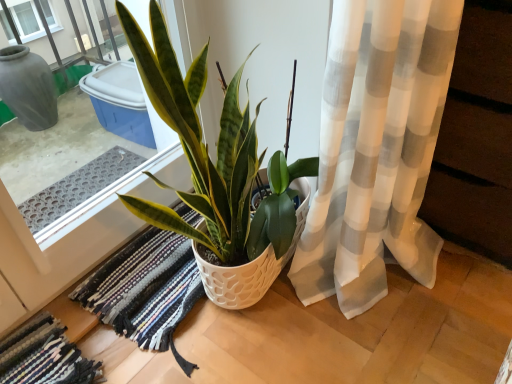
What do you see at coordinates (219, 176) in the screenshot? The height and width of the screenshot is (384, 512). I see `green glossy plant at center` at bounding box center [219, 176].

What do you see at coordinates (146, 290) in the screenshot? The image size is (512, 384). I see `multicolored woven rug at center, the 1th bath mat from the right` at bounding box center [146, 290].

Locate an element on the screen. multicolored woven rug at lower left, which ranks as the 1th bath mat in left-to-right order is located at coordinates (44, 356).

Is multicolored woven rug at lower left, which ranks as the 1th bath mat in left-to-right order, further to the viewer compared to multicolored woven rug at center, the 1th bath mat from the right?

No, multicolored woven rug at lower left, which ranks as the 1th bath mat in left-to-right order, is closer to the viewer.

Is multicolored woven rug at lower left, which is the second bath mat in right-to-left order, bigger or smaller than multicolored woven rug at center, the second bath mat from the left?

multicolored woven rug at lower left, which is the second bath mat in right-to-left order, is smaller than multicolored woven rug at center, the second bath mat from the left.

Can you confirm if multicolored woven rug at lower left, which ranks as the 1th bath mat in left-to-right order, is shorter than multicolored woven rug at center, the second bath mat from the left?

Incorrect, the height of multicolored woven rug at lower left, which ranks as the 1th bath mat in left-to-right order, does not fall short of that of multicolored woven rug at center, the second bath mat from the left.

Find the location of `bath mat in front of the multicolored woven rug at center, the second bath mat from the left`. bath mat in front of the multicolored woven rug at center, the second bath mat from the left is located at coordinates (44, 356).

Considering the relative sizes of multicolored woven rug at center, the second bath mat from the left, and multicolored woven rug at lower left, which ranks as the 1th bath mat in left-to-right order, in the image provided, is multicolored woven rug at center, the second bath mat from the left, wider than multicolored woven rug at lower left, which ranks as the 1th bath mat in left-to-right order,?

Yes, multicolored woven rug at center, the second bath mat from the left, is wider than multicolored woven rug at lower left, which ranks as the 1th bath mat in left-to-right order.

Which of these two, multicolored woven rug at center, the second bath mat from the left, or multicolored woven rug at lower left, which is the second bath mat in right-to-left order, is smaller?

Smaller between the two is multicolored woven rug at lower left, which is the second bath mat in right-to-left order.

Is multicolored woven rug at center, the second bath mat from the left, next to multicolored woven rug at lower left, which is the second bath mat in right-to-left order?

No.

This screenshot has height=384, width=512. Identify the location of bath mat on the right side of multicolored woven rug at lower left, which is the second bath mat in right-to-left order. (146, 290).

How different are the orientations of multicolored woven rug at lower left, which ranks as the 1th bath mat in left-to-right order, and green glossy plant at center in degrees?

multicolored woven rug at lower left, which ranks as the 1th bath mat in left-to-right order, and green glossy plant at center are facing 2.67 degrees away from each other.

From a real-world perspective, which is physically below, multicolored woven rug at lower left, which ranks as the 1th bath mat in left-to-right order, or green glossy plant at center?

From a 3D spatial view, multicolored woven rug at lower left, which ranks as the 1th bath mat in left-to-right order, is below.

Considering the sizes of multicolored woven rug at lower left, which is the second bath mat in right-to-left order, and green glossy plant at center in the image, is multicolored woven rug at lower left, which is the second bath mat in right-to-left order, taller or shorter than green glossy plant at center?

multicolored woven rug at lower left, which is the second bath mat in right-to-left order, is shorter than green glossy plant at center.

Could you tell me if multicolored woven rug at lower left, which ranks as the 1th bath mat in left-to-right order, is facing green glossy plant at center?

No, multicolored woven rug at lower left, which ranks as the 1th bath mat in left-to-right order, is not facing towards green glossy plant at center.

From the image's perspective, relative to multicolored woven rug at lower left, which is the second bath mat in right-to-left order, is green glossy plant at center above or below?

From the image's perspective, green glossy plant at center appears above multicolored woven rug at lower left, which is the second bath mat in right-to-left order.

Relative to multicolored woven rug at lower left, which is the second bath mat in right-to-left order, is green glossy plant at center in front or behind?

In the image, green glossy plant at center appears in front of multicolored woven rug at lower left, which is the second bath mat in right-to-left order.

Does green glossy plant at center have a lesser height compared to multicolored woven rug at lower left, which ranks as the 1th bath mat in left-to-right order?

No, green glossy plant at center is not shorter than multicolored woven rug at lower left, which ranks as the 1th bath mat in left-to-right order.

Is green glossy plant at center turned away from multicolored woven rug at lower left, which ranks as the 1th bath mat in left-to-right order?

No, green glossy plant at center is not facing away from multicolored woven rug at lower left, which ranks as the 1th bath mat in left-to-right order.

From a real-world perspective, which is physically below, multicolored woven rug at center, the second bath mat from the left, or green glossy plant at center?

multicolored woven rug at center, the second bath mat from the left, from a real-world perspective.

Based on their positions, is multicolored woven rug at center, the second bath mat from the left, located to the left or right of green glossy plant at center?

multicolored woven rug at center, the second bath mat from the left, is positioned on green glossy plant at center's left side.

Is multicolored woven rug at center, the second bath mat from the left, inside the boundaries of green glossy plant at center, or outside?

multicolored woven rug at center, the second bath mat from the left, is located inside green glossy plant at center.

Consider the image. Between multicolored woven rug at center, the second bath mat from the left, and green glossy plant at center, which one has less height?

Standing shorter between the two is multicolored woven rug at center, the second bath mat from the left.

Is green glossy plant at center taller or shorter than multicolored woven rug at center, the second bath mat from the left?

In the image, green glossy plant at center appears to be taller than multicolored woven rug at center, the second bath mat from the left.

From a real-world perspective, is green glossy plant at center on top of multicolored woven rug at center, the 1th bath mat from the right?

Indeed, from a real-world perspective, green glossy plant at center stands above multicolored woven rug at center, the 1th bath mat from the right.

Considering the relative positions of green glossy plant at center and multicolored woven rug at center, the second bath mat from the left, in the image provided, is green glossy plant at center in front of multicolored woven rug at center, the second bath mat from the left,?

Yes, the depth of green glossy plant at center is less than that of multicolored woven rug at center, the second bath mat from the left.

Which is behind, point (295, 242) or point (150, 252)?

Positioned behind is point (150, 252).

Find the location of a particular element. This screenshot has width=512, height=384. bath mat in front of the multicolored woven rug at center, the 1th bath mat from the right is located at coordinates (44, 356).

Image resolution: width=512 pixels, height=384 pixels. I want to click on bath mat that appears above the multicolored woven rug at center, the 1th bath mat from the right (from a real-world perspective), so click(44, 356).

Looking at this image, based on their spatial positions, is multicolored woven rug at lower left, which ranks as the 1th bath mat in left-to-right order, or green glossy plant at center closer to multicolored woven rug at center, the second bath mat from the left?

Based on the image, multicolored woven rug at lower left, which ranks as the 1th bath mat in left-to-right order, appears to be nearer to multicolored woven rug at center, the second bath mat from the left.

Considering their positions, is multicolored woven rug at lower left, which ranks as the 1th bath mat in left-to-right order, positioned further to green glossy plant at center than multicolored woven rug at center, the second bath mat from the left?

Among the two, multicolored woven rug at lower left, which ranks as the 1th bath mat in left-to-right order, is located further to green glossy plant at center.

Estimate the real-world distances between objects in this image. Which object is closer to green glossy plant at center, multicolored woven rug at center, the second bath mat from the left, or multicolored woven rug at lower left, which ranks as the 1th bath mat in left-to-right order?

multicolored woven rug at center, the second bath mat from the left, lies closer to green glossy plant at center than the other object.

Which object lies further to the anchor point multicolored woven rug at lower left, which ranks as the 1th bath mat in left-to-right order, multicolored woven rug at center, the 1th bath mat from the right, or green glossy plant at center?

Among the two, green glossy plant at center is located further to multicolored woven rug at lower left, which ranks as the 1th bath mat in left-to-right order.

Based on their spatial positions, is green glossy plant at center or multicolored woven rug at lower left, which is the second bath mat in right-to-left order, further from multicolored woven rug at center, the 1th bath mat from the right?

green glossy plant at center is further to multicolored woven rug at center, the 1th bath mat from the right.

When comparing their distances from multicolored woven rug at lower left, which ranks as the 1th bath mat in left-to-right order, does green glossy plant at center or multicolored woven rug at center, the second bath mat from the left, seem closer?

The object closer to multicolored woven rug at lower left, which ranks as the 1th bath mat in left-to-right order, is multicolored woven rug at center, the second bath mat from the left.

Identify the location of bath mat that lies between green glossy plant at center and multicolored woven rug at lower left, which is the second bath mat in right-to-left order, from top to bottom. The height and width of the screenshot is (384, 512). (146, 290).